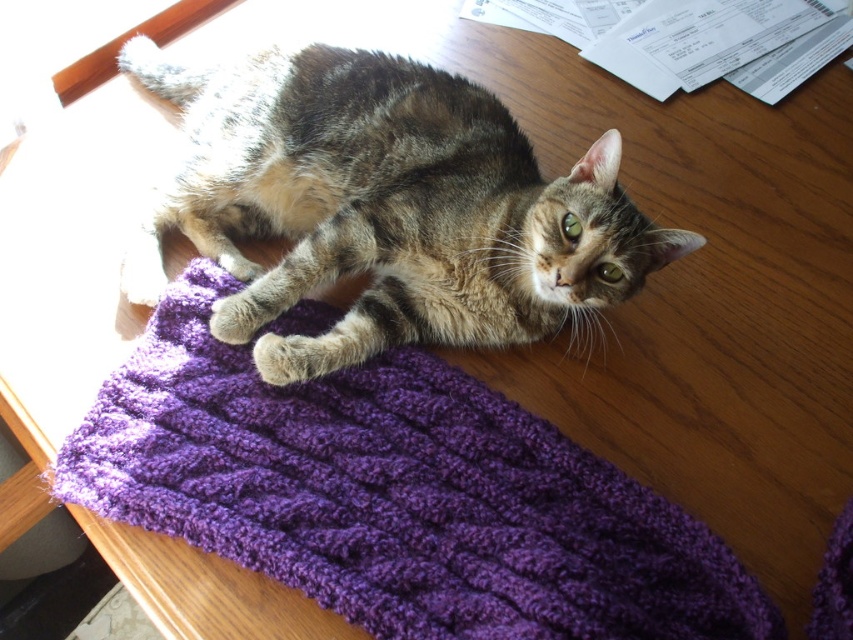
You are an interior designer assessing the placement of items in a room. You see the purple knitted mat at upper center and the tabby fur cat at center. Which item occupies more space horizontally?

The tabby fur cat at center occupies more horizontal space than the purple knitted mat at upper center because the purple knitted mat at upper center is shorter than the cat.

From the picture: You are a photographer aiming to capture a closeup shot of the purple knitted mat at upper center. The camera you are using has a minimum focusing distance of 30 inches. Can you take the photo without moving the camera closer?

The purple knitted mat at upper center is 38.86 inches from the camera. Since the minimum focusing distance is 30 inches, the camera can focus on the purple knitted mat at upper center without needing to move closer.

You are an animal photographer who wants to take a photo of the tabby fur cat at center. The purple knitted mat at upper center is blocking the view. Can you move the mat to the left to get a clear shot of the cat?

The purple knitted mat at upper center is to the right of the tabby fur cat at center, so moving it to the left would place it away from the cat, allowing for a clear photo.